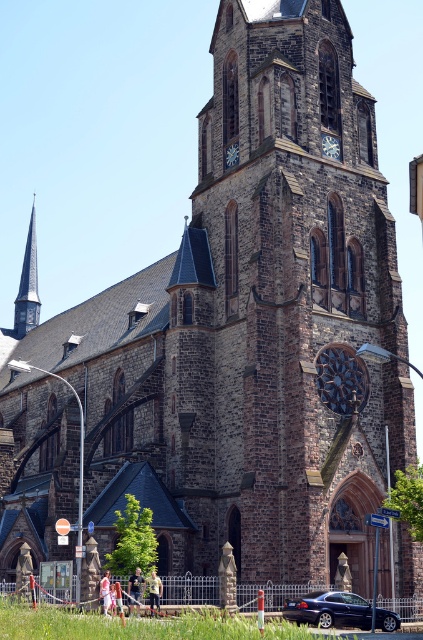
You are a delivery person who needs to park your 15 feet long truck between the metallic blue sedan at lower right and the light pink fabric at lower center. Can you fit your truck in that space?

The metallic blue sedan at lower right and the light pink fabric at lower center are 21.20 feet apart from each other. Since your truck is 15 feet long, it can fit in the space between them as there is enough room.